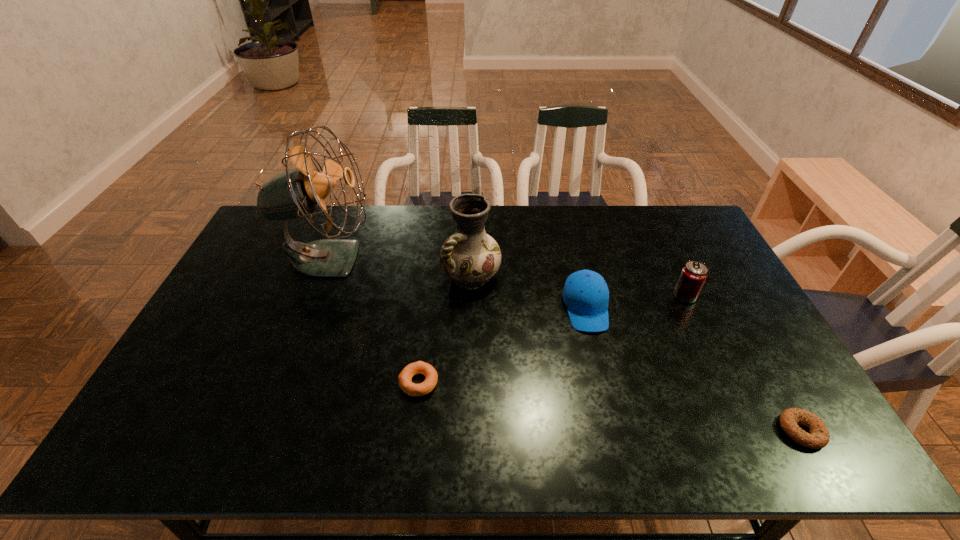
Where is `blank space at the near right corner of the desktop`? blank space at the near right corner of the desktop is located at coordinates (x=831, y=449).

Locate an element on the screen. free space between the rightmost object and the fan is located at coordinates (564, 345).

The image size is (960, 540). I want to click on blank region between the vase and the tallest object, so click(399, 267).

Where is `vacant space that is in between the left bagel and the pop soda`? vacant space that is in between the left bagel and the pop soda is located at coordinates (552, 339).

Where is `unoccupied area between the right bagel and the vase`? This screenshot has height=540, width=960. unoccupied area between the right bagel and the vase is located at coordinates (636, 353).

The width and height of the screenshot is (960, 540). I want to click on free space between the tallest object and the farther bagel, so click(x=373, y=320).

The image size is (960, 540). I want to click on free area in between the farther bagel and the fourth shortest object, so click(x=552, y=339).

Locate an element on the screen. The image size is (960, 540). free space between the right bagel and the second tallest object is located at coordinates (636, 353).

Find the location of a particular element. The height and width of the screenshot is (540, 960). vacant area that lies between the cap and the third tallest object is located at coordinates (636, 302).

Select which object is the closest to the pop soda. Please provide its 2D coordinates. Your answer should be formatted as a tuple, i.e. [(x, y)], where the tuple contains the x and y coordinates of a point satisfying the conditions above.

[(586, 295)]